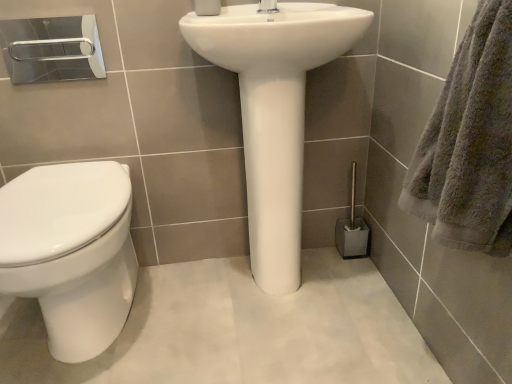
You are a GUI agent. You are given a task and a screenshot of the screen. Output one action in this format:
    pyautogui.click(x=<x>, y=<y>)
    Task: Click on the free location in front of white glossy sink at center
    The width and height of the screenshot is (512, 384).
    Given the screenshot: What is the action you would take?
    pyautogui.click(x=290, y=347)